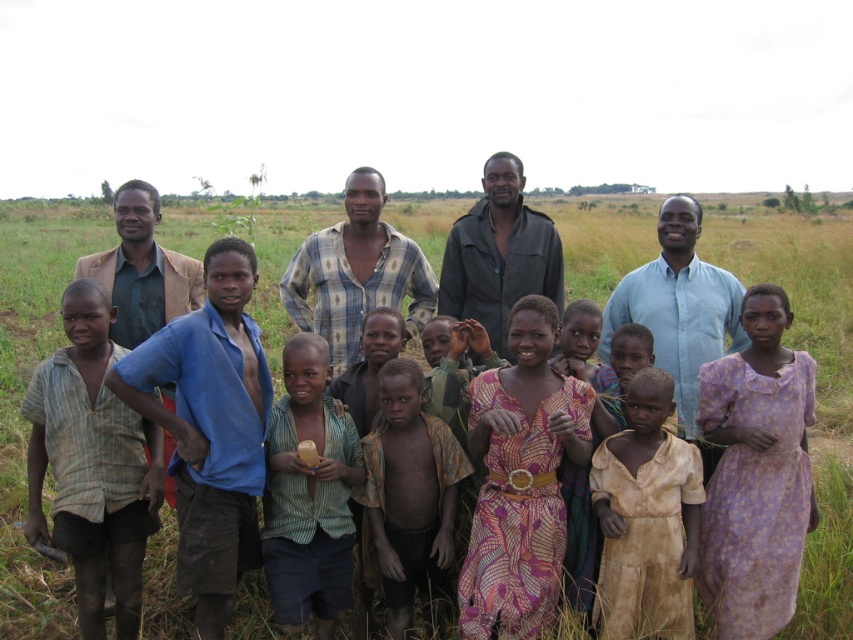
Locate an element on the screen. The height and width of the screenshot is (640, 853). dark green jacket at center is located at coordinates (498, 253).

Can you confirm if dark green jacket at center is positioned below brown textured jacket at left?

Yes.

This screenshot has width=853, height=640. What do you see at coordinates (498, 253) in the screenshot? I see `dark green jacket at center` at bounding box center [498, 253].

Where is `dark green jacket at center`? The image size is (853, 640). dark green jacket at center is located at coordinates (498, 253).

Is brown textured shirt at center behind brown textured jacket at left?

Yes.

In the scene shown: Is brown textured shirt at center smaller than brown textured jacket at left?

Correct, brown textured shirt at center occupies less space than brown textured jacket at left.

The height and width of the screenshot is (640, 853). What do you see at coordinates (408, 496) in the screenshot? I see `brown textured shirt at center` at bounding box center [408, 496].

In order to click on brown textured shirt at center in this screenshot , I will do `click(408, 496)`.

Is blue cotton shirt at center closer to the viewer compared to brown textured shirt at center?

Yes, it is.

Is point (198, 488) closer to viewer compared to point (415, 524)?

Yes, point (198, 488) is in front of point (415, 524).

Is point (178, 337) in front of point (393, 627)?

Yes, point (178, 337) is in front of point (393, 627).

Locate an element on the screen. blue cotton shirt at center is located at coordinates (210, 428).